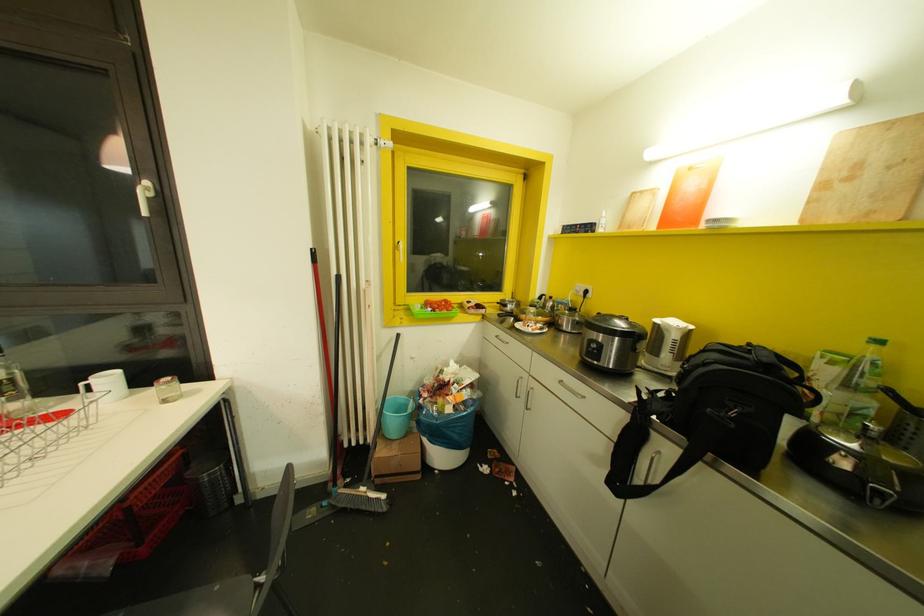
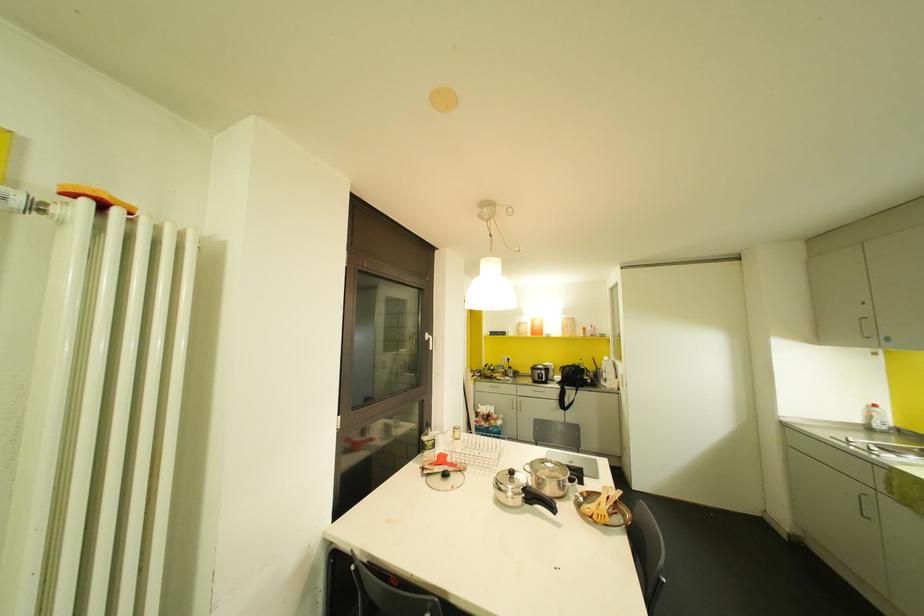
Where in the second image is the point corresponding to (679,215) from the first image?

(536, 331)